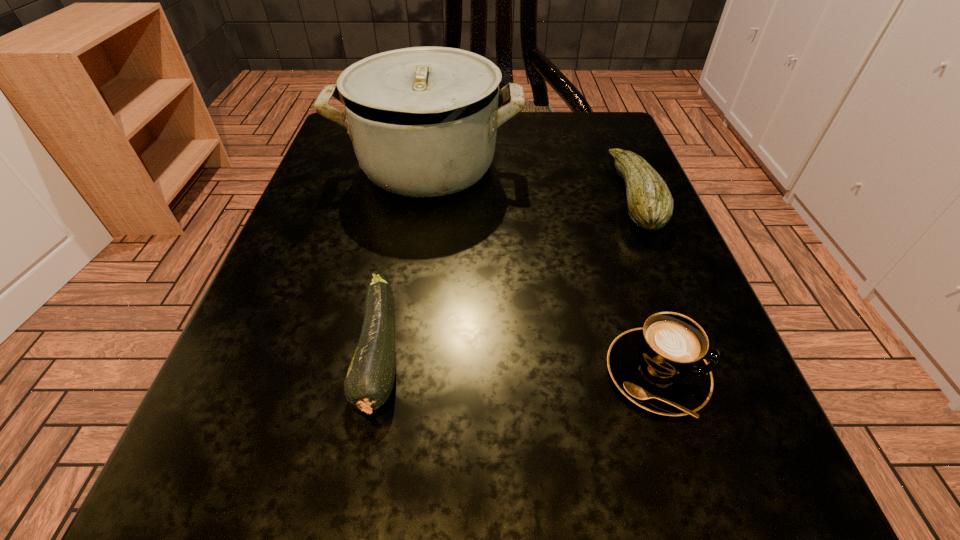
Locate an element on the screen. The height and width of the screenshot is (540, 960). vacant space located at the stem end of the right zucchini is located at coordinates (394, 195).

Identify the location of saucepan that is at the far edge. (423, 121).

Image resolution: width=960 pixels, height=540 pixels. Identify the location of zucchini that is positioned at the far edge. (650, 204).

Image resolution: width=960 pixels, height=540 pixels. What are the coordinates of `saucepan located at the left edge` in the screenshot? It's located at (423, 121).

Locate an element on the screen. This screenshot has height=540, width=960. zucchini located at the left edge is located at coordinates (369, 381).

Locate an element on the screen. This screenshot has height=540, width=960. cappuccino at the right edge is located at coordinates (661, 367).

Identify the location of zucchini situated at the right edge. This screenshot has height=540, width=960. (650, 204).

Where is `object that is at the far left corner`? This screenshot has width=960, height=540. object that is at the far left corner is located at coordinates (423, 121).

The image size is (960, 540). Find the location of `object situated at the far right corner`. object situated at the far right corner is located at coordinates (650, 204).

In the image, there is a desktop. Identify the location of free space at the far edge. (503, 165).